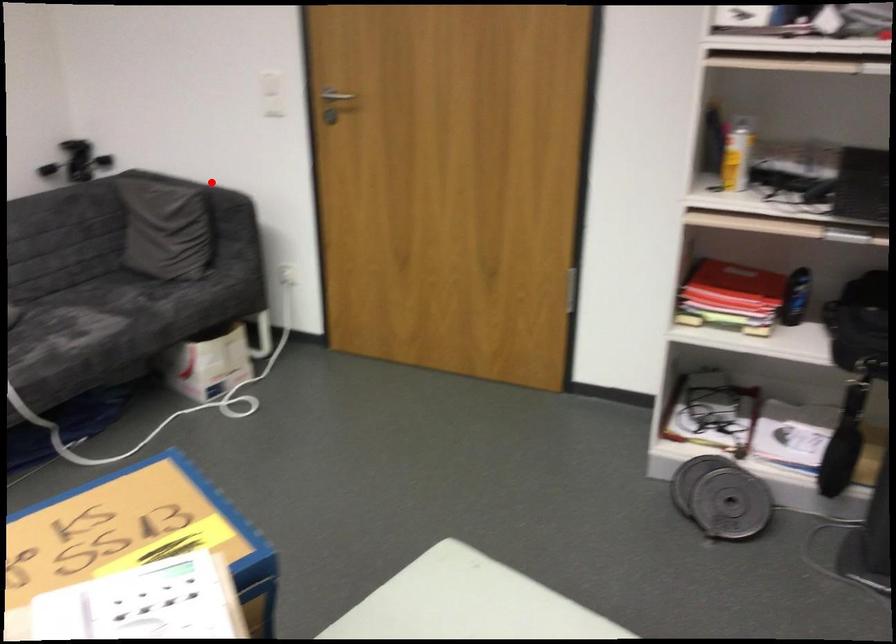
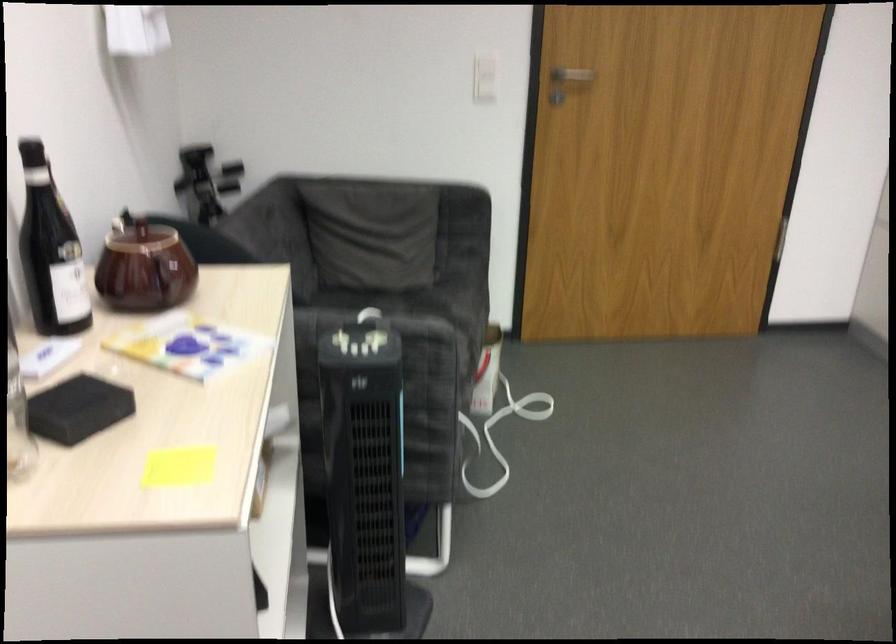
Question: I am providing you with two images of the same scene from different viewpoints. Image1 has a red point marked. In image2, the corresponding 3D location appears at what relative position? Reply with the corresponding letter.

Choices:
 (A) Closer
 (B) Farther

Answer: (A)